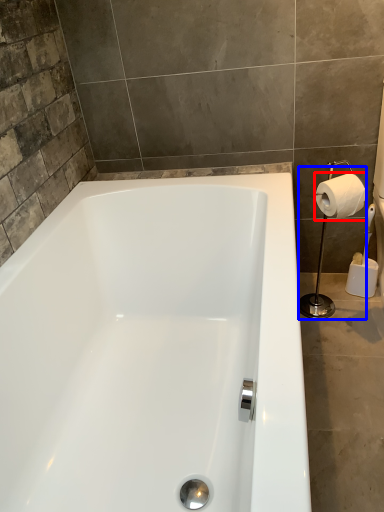
Question: Which point is further to the camera, toilet paper (highlighted by a red box) or shower (highlighted by a blue box)?

Choices:
 (A) toilet paper
 (B) shower

Answer: (B)